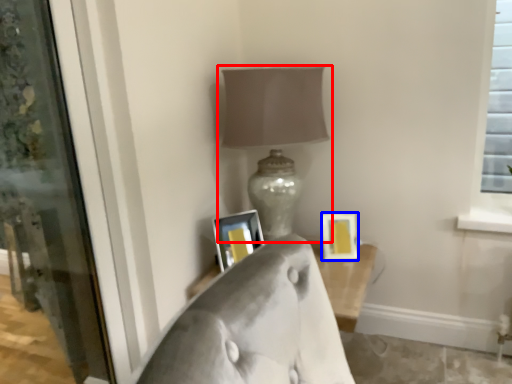
Question: Among these objects, which one is farthest to the camera, lamp (highlighted by a red box) or picture frame (highlighted by a blue box)?

Choices:
 (A) lamp
 (B) picture frame

Answer: (B)